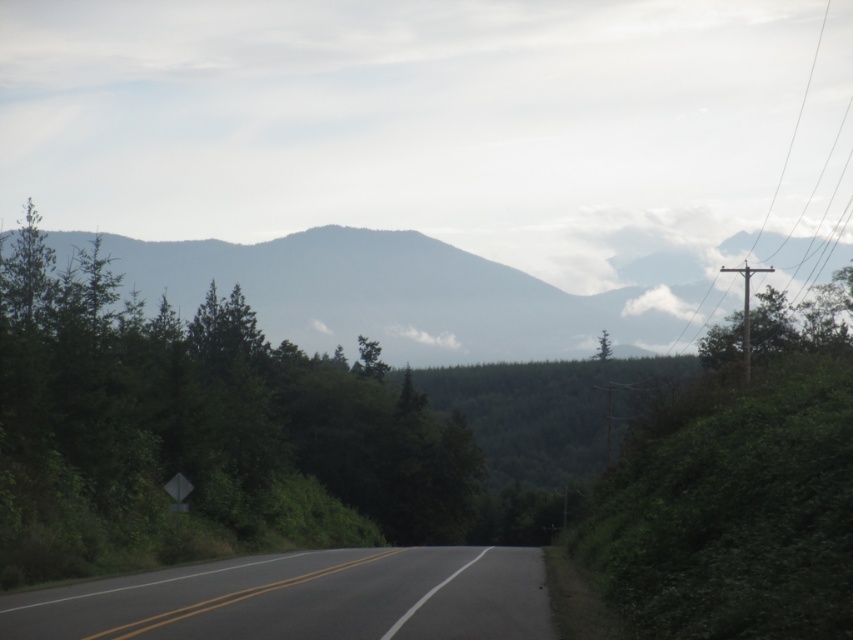
Does gray foggy mountain at center lie in front of black asphalt road at center?

That is False.

Between gray foggy mountain at center and black asphalt road at center, which one is positioned lower?

black asphalt road at center is below.

Is point (183, 288) in front of point (366, 595)?

That is False.

I want to click on gray foggy mountain at center, so click(401, 296).

Is point (283, 444) positioned behind point (643, 330)?

That is False.

Is green leafy tree at center to the left of gray foggy mountain at center from the viewer's perspective?

Correct, you'll find green leafy tree at center to the left of gray foggy mountain at center.

Locate an element on the screen. The width and height of the screenshot is (853, 640). green leafy tree at center is located at coordinates (196, 432).

Is green leafy tree at center bigger than black asphalt road at center?

Yes, green leafy tree at center is bigger than black asphalt road at center.

Between green leafy tree at center and black asphalt road at center, which one is positioned lower?

black asphalt road at center is lower down.

This screenshot has height=640, width=853. What do you see at coordinates (196, 432) in the screenshot?
I see `green leafy tree at center` at bounding box center [196, 432].

Find the location of a particular element. green leafy tree at center is located at coordinates (196, 432).